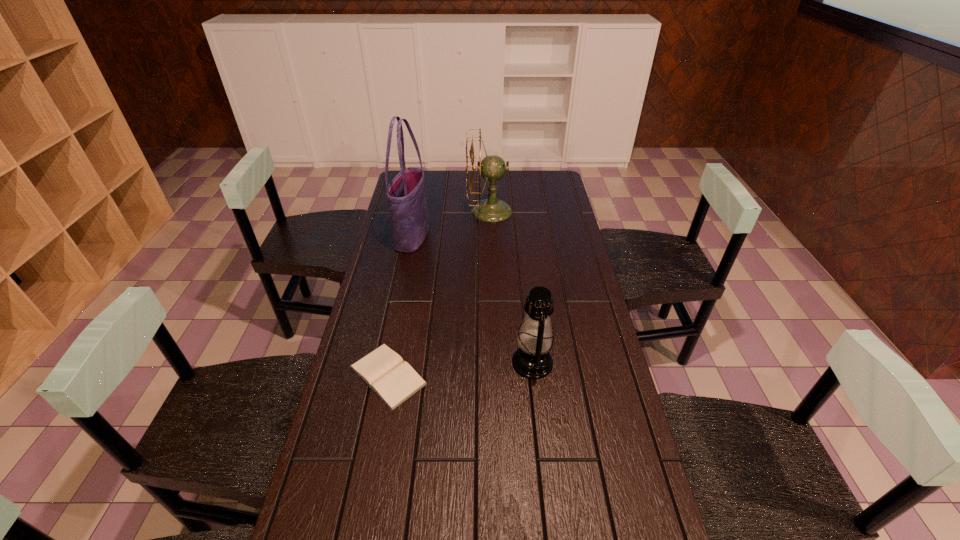
Choose which object is the third nearest neighbor to the oil lamp. Please provide its 2D coordinates. Your answer should be formatted as a tuple, i.e. [(x, y)], where the tuple contains the x and y coordinates of a point satisfying the conditions above.

[(492, 168)]

Identify the location of object that is the second closest to the third shortest object. (532, 360).

Locate an element on the screen. The image size is (960, 540). vacant space that satisfies the following two spatial constraints: 1. in front of the second tallest object, directing air flow; 2. on the front side of the tote bag is located at coordinates (491, 238).